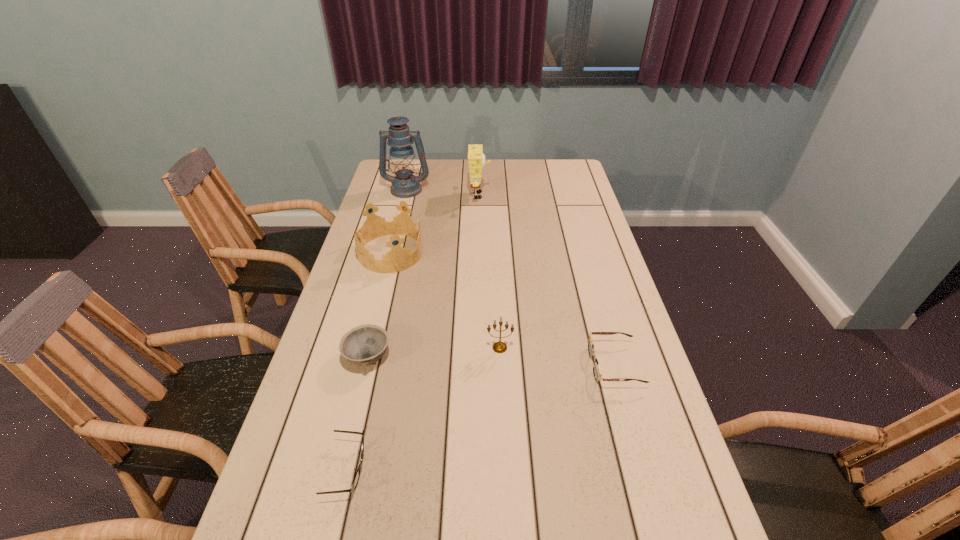
Locate an element on the screen. This screenshot has width=960, height=540. free location located on the front-facing side of the sponge is located at coordinates (502, 195).

Locate an element on the screen. vacant space positioned on the front-facing side of the third farthest object is located at coordinates (526, 253).

Locate an element on the screen. Image resolution: width=960 pixels, height=540 pixels. vacant area located on the front of the candelabrum is located at coordinates (502, 407).

Where is `free location located on the left of the bowl`? The image size is (960, 540). free location located on the left of the bowl is located at coordinates (324, 357).

You are a GUI agent. You are given a task and a screenshot of the screen. Output one action in this format:
    pyautogui.click(x=<x>, y=<y>)
    Task: Click on the free space located 0.280m on the frame of the right spectacles
    The image size is (960, 540).
    Given the screenshot: What is the action you would take?
    pyautogui.click(x=482, y=364)

What are the coordinates of `free spot located on the frame of the right spectacles` in the screenshot? It's located at (532, 364).

The image size is (960, 540). What are the coordinates of `free space located on the frame of the right spectacles` in the screenshot? It's located at (552, 364).

Identify the location of vacant space located 0.270m on the front-facing side of the nearer spectacles. (492, 469).

Identify the location of lantern that is at the far edge. This screenshot has height=540, width=960. (404, 185).

Where is `sponge that is positioned at the far edge`? The height and width of the screenshot is (540, 960). sponge that is positioned at the far edge is located at coordinates (476, 159).